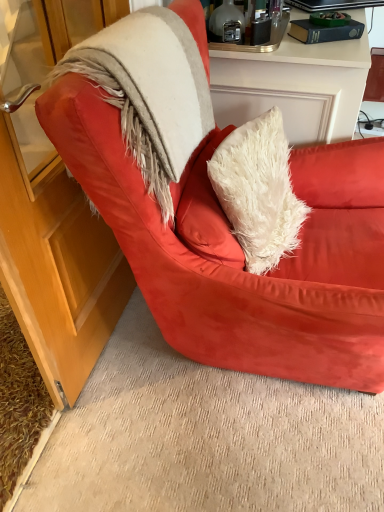
The image size is (384, 512). What do you see at coordinates (232, 269) in the screenshot?
I see `suede red armchair at center` at bounding box center [232, 269].

Identify the location of suede red armchair at center. The width and height of the screenshot is (384, 512). (232, 269).

Which is in front, fuzzy beige fur coat at upper left or suede red armchair at center?

suede red armchair at center is closer to the camera.

From the image's perspective, is fuzzy beige fur coat at upper left located above suede red armchair at center?

Yes, from the image's perspective, fuzzy beige fur coat at upper left is over suede red armchair at center.

The height and width of the screenshot is (512, 384). What are the coordinates of `fur coat above the suede red armchair at center (from the image's perspective)` in the screenshot? It's located at [x=150, y=92].

Can you tell me how much suede red armchair at center and fuzzy beige fur coat at upper left differ in facing direction?

The angular difference between suede red armchair at center and fuzzy beige fur coat at upper left is 2.11 degrees.

Is point (360, 286) in front of point (152, 106)?

No, it is behind (152, 106).

Which object is closer to the camera, suede red armchair at center or fuzzy beige fur coat at upper left?

suede red armchair at center is in front.

Measure the distance from suede red armchair at center to fuzzy beige fur coat at upper left.

suede red armchair at center is 10.42 inches away from fuzzy beige fur coat at upper left.

Considering the relative positions of suede red armchair at center and black glossy laptop at upper right in the image provided, is suede red armchair at center to the left or to the right of black glossy laptop at upper right?

From the image, it's evident that suede red armchair at center is to the left of black glossy laptop at upper right.

Considering their positions, is suede red armchair at center located in front of or behind black glossy laptop at upper right?

Clearly, suede red armchair at center is in front of black glossy laptop at upper right.

Considering the positions of point (290, 359) and point (377, 0), is point (290, 359) closer or farther from the camera than point (377, 0)?

Clearly, point (290, 359) is closer to the camera than point (377, 0).

Considering the relative sizes of black glossy laptop at upper right and suede red armchair at center in the image provided, is black glossy laptop at upper right wider than suede red armchair at center?

No.

Between point (359, 5) and point (347, 209), which one is positioned in front?

Point (347, 209)

Who is smaller, black glossy laptop at upper right or suede red armchair at center?

Smaller between the two is black glossy laptop at upper right.

Is black glossy laptop at upper right taller than suede red armchair at center?

Incorrect, the height of black glossy laptop at upper right is not larger of that of suede red armchair at center.

Is black glossy laptop at upper right looking in the opposite direction of fuzzy beige fur coat at upper left?

No, black glossy laptop at upper right's orientation is not away from fuzzy beige fur coat at upper left.

Is black glossy laptop at upper right touching fuzzy beige fur coat at upper left?

No.

Is black glossy laptop at upper right smaller than fuzzy beige fur coat at upper left?

Correct, black glossy laptop at upper right occupies less space than fuzzy beige fur coat at upper left.

Where is `laptop below the fuzzy beige fur coat at upper left (from a real-world perspective)`? This screenshot has width=384, height=512. laptop below the fuzzy beige fur coat at upper left (from a real-world perspective) is located at coordinates (332, 4).

Find the location of a particular element. This screenshot has height=512, width=384. fur coat that appears on the left of black glossy laptop at upper right is located at coordinates (150, 92).

Between fuzzy beige fur coat at upper left and black glossy laptop at upper right, which one has smaller size?

black glossy laptop at upper right is smaller.

From their relative heights in the image, would you say fuzzy beige fur coat at upper left is taller or shorter than black glossy laptop at upper right?

fuzzy beige fur coat at upper left is taller than black glossy laptop at upper right.

Where is `fur coat that is on the left side of suede red armchair at center`? This screenshot has height=512, width=384. fur coat that is on the left side of suede red armchair at center is located at coordinates (150, 92).

Locate an element on the screen. The width and height of the screenshot is (384, 512). chair below the fuzzy beige fur coat at upper left (from a real-world perspective) is located at coordinates (232, 269).

Considering their positions, is suede red armchair at center positioned further to black glossy laptop at upper right than fuzzy beige fur coat at upper left?

Based on the image, suede red armchair at center appears to be further to black glossy laptop at upper right.

Considering their positions, is fuzzy beige fur coat at upper left positioned further to black glossy laptop at upper right than suede red armchair at center?

Among the two, suede red armchair at center is located further to black glossy laptop at upper right.

Looking at the image, which one is located further to suede red armchair at center, black glossy laptop at upper right or fuzzy beige fur coat at upper left?

black glossy laptop at upper right is positioned further to the anchor suede red armchair at center.

Based on their spatial positions, is suede red armchair at center or black glossy laptop at upper right further from fuzzy beige fur coat at upper left?

black glossy laptop at upper right.

From the picture: From the image, which object appears to be farther from suede red armchair at center, fuzzy beige fur coat at upper left or black glossy laptop at upper right?

black glossy laptop at upper right lies further to suede red armchair at center than the other object.

Considering their positions, is black glossy laptop at upper right positioned further to fuzzy beige fur coat at upper left than suede red armchair at center?

The object further to fuzzy beige fur coat at upper left is black glossy laptop at upper right.

Find the location of a particular element. Image resolution: width=384 pixels, height=512 pixels. fur coat located between suede red armchair at center and black glossy laptop at upper right in the depth direction is located at coordinates (150, 92).